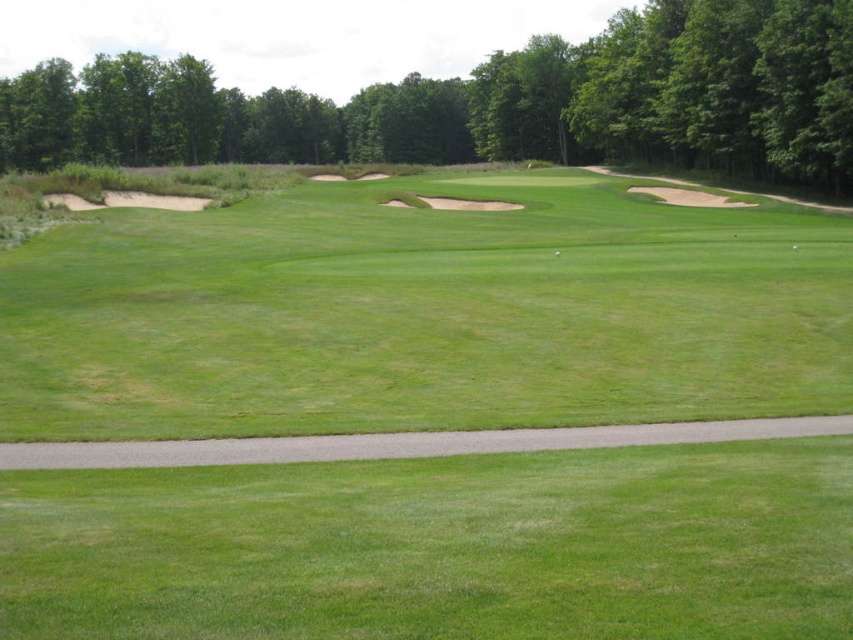
You are a golfer standing on the fairway and see the green leafy tree at upper center and the white matte golf ball at center. Which object is bigger in size?

The green leafy tree at upper center is larger in size compared to the white matte golf ball at center.

You are a golfer standing at the tee box and want to hit your ball towards the green. There is a green leafy tree at upper center and a white matte golf ball at center in your line of sight. Which object is positioned to the left of the other?

The green leafy tree at upper center is to the left of the white matte golf ball at center.